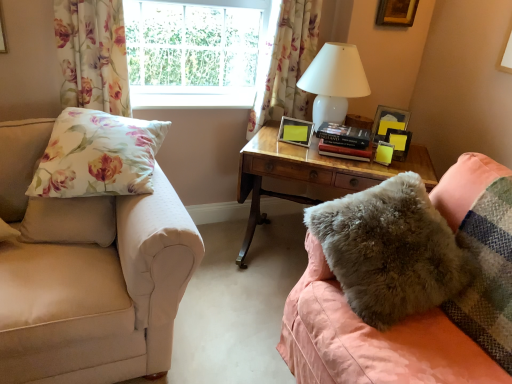
I want to click on free space in front of hardcover book at center, so click(x=351, y=164).